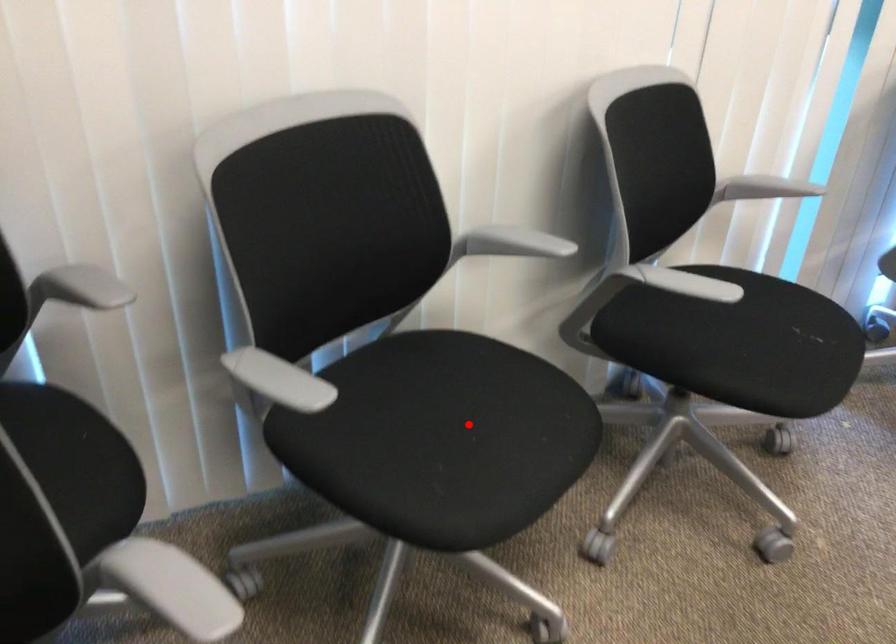
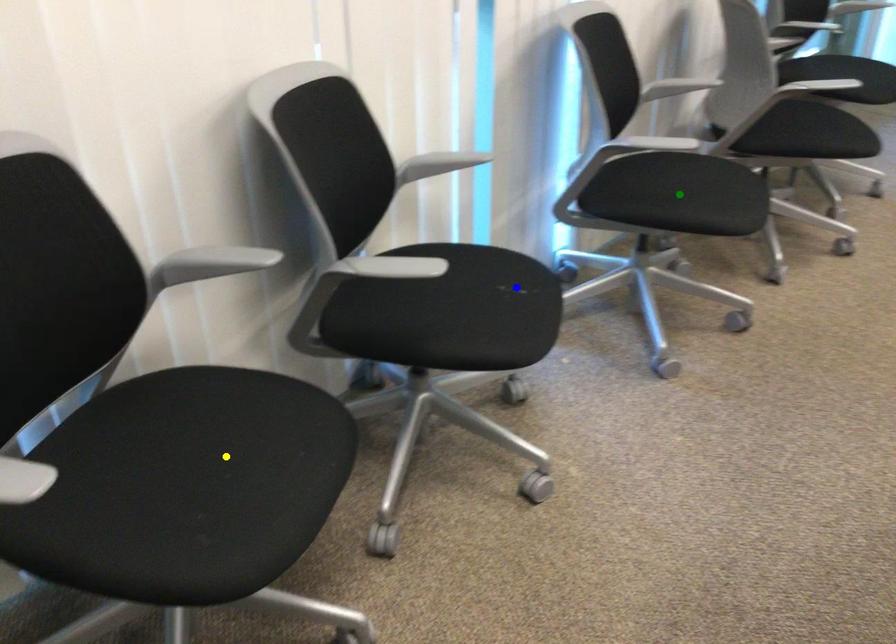
Question: I am providing you with two images of the same scene from different viewpoints. A red point is marked on the first image. You are given multiple points on the second image. In image 2, which mark is for the same physical point as the one in image 1?

Choices:
 (A) green point
 (B) yellow point
 (C) blue point

Answer: (B)